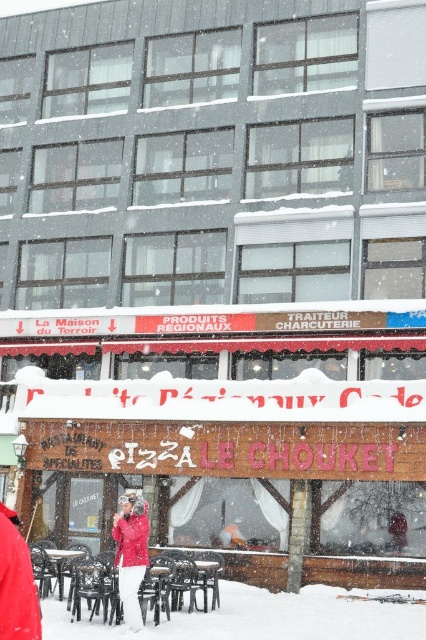
Does point (250, 625) lie behind point (137, 572)?

Yes, point (250, 625) is farther from viewer.

Which of these two, white powdery snow at lower center or red matte jacket at center, stands taller?

Standing taller between the two is white powdery snow at lower center.

Which is behind, point (351, 593) or point (134, 563)?

The point (351, 593) is more distant.

The height and width of the screenshot is (640, 426). Find the location of `white powdery snow at lower center`. white powdery snow at lower center is located at coordinates (259, 618).

In the scene shown: Who is positioned more to the right, red matte jacket at center or matte red jacket at center?

From the viewer's perspective, red matte jacket at center appears more on the right side.

Does red matte jacket at center have a lesser height compared to matte red jacket at center?

Correct, red matte jacket at center is not as tall as matte red jacket at center.

Is point (127, 524) positioned behind point (132, 541)?

That is True.

Find the location of a particular element. The height and width of the screenshot is (640, 426). red matte jacket at center is located at coordinates (131, 554).

Between point (161, 627) and point (132, 513), which one is positioned behind?

Point (132, 513)

Is white powdery snow at lower center closer to the viewer compared to matte red jacket at center?

Yes, it is.

What do you see at coordinates (259, 618) in the screenshot? I see `white powdery snow at lower center` at bounding box center [259, 618].

The image size is (426, 640). What are the coordinates of `white powdery snow at lower center` in the screenshot? It's located at (259, 618).